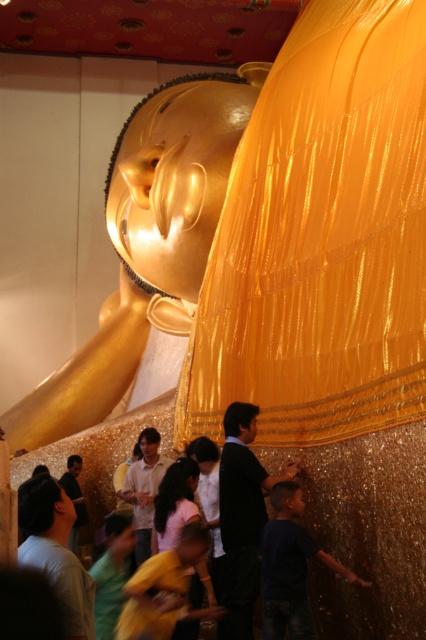
You are a visitor standing at the entrance of the temple. You want to take a photo of the gold shiny statue at center and the matte gold monk at center together in the frame. Which direction should you move to ensure both are visible in your camera view?

You should move to the right side of the temple so that the gold shiny statue at center and the matte gold monk at center are positioned side by side in your camera view.

You are a visitor standing at the entrance of the temple. You see the black matte monk at center and the matte gold monk at center. Which one is closer to you?

The black matte monk at center is closer to you because it is in front of the matte gold monk at center.